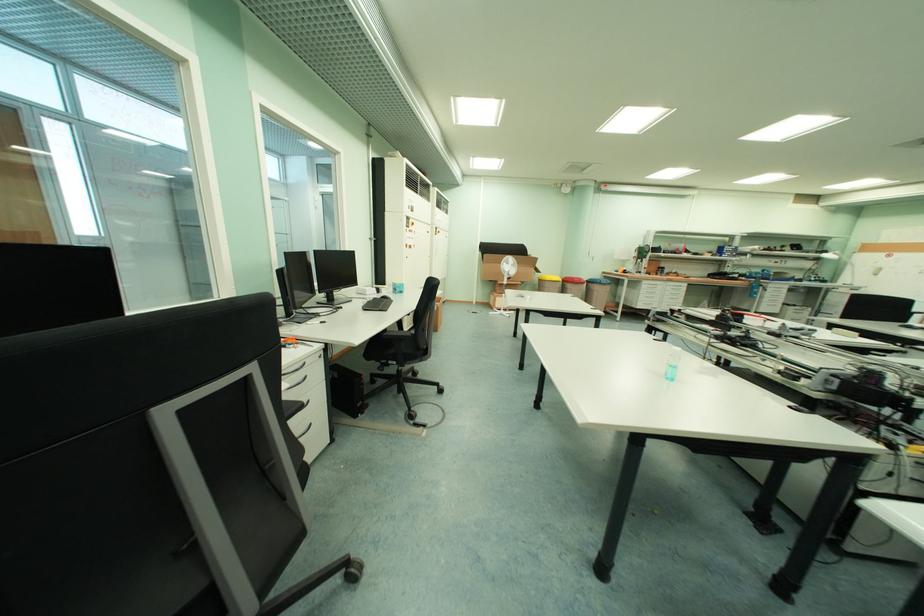
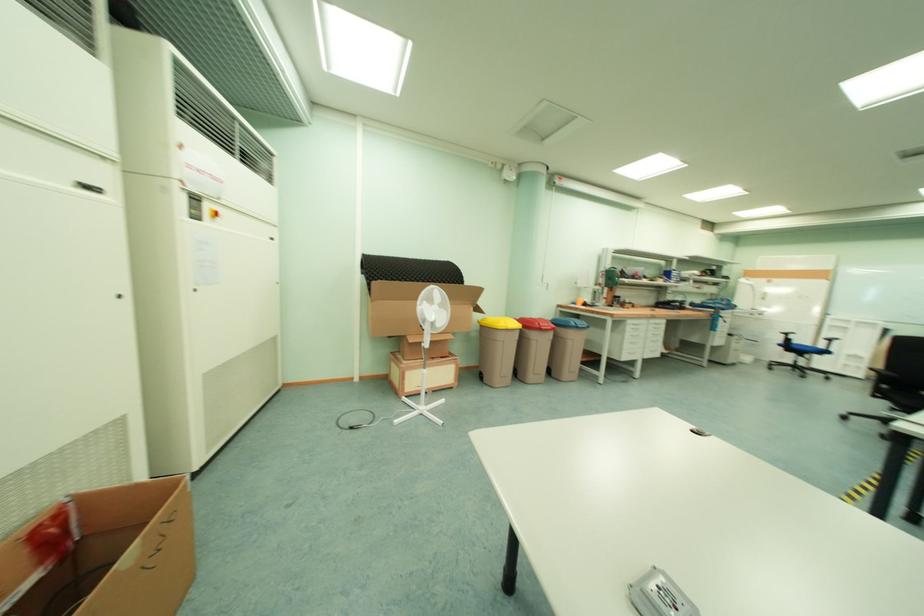
Question: In a continuous first-person perspective shot, in which direction is the camera moving?

Choices:
 (A) Left
 (B) Right
 (C) Forward
 (D) Backward

Answer: (C)